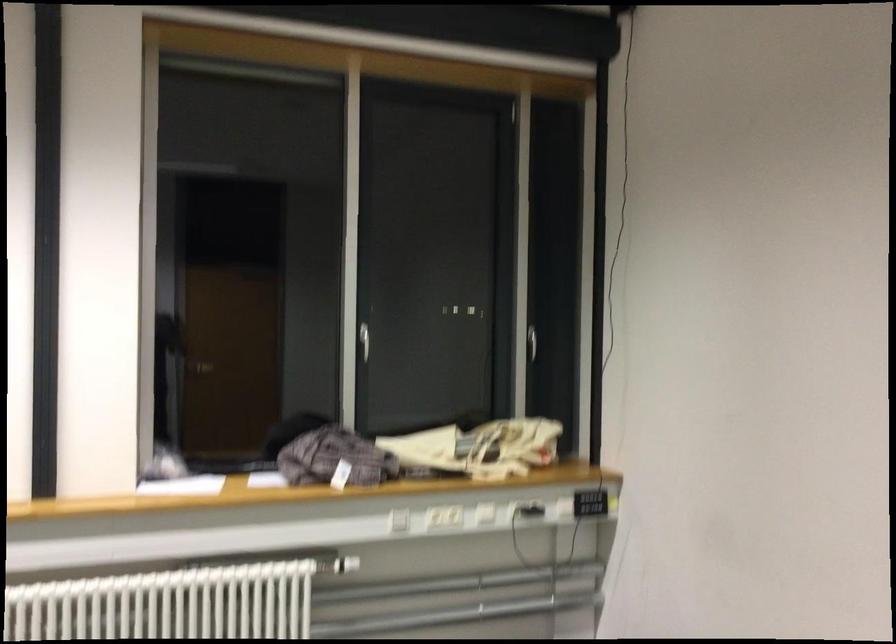
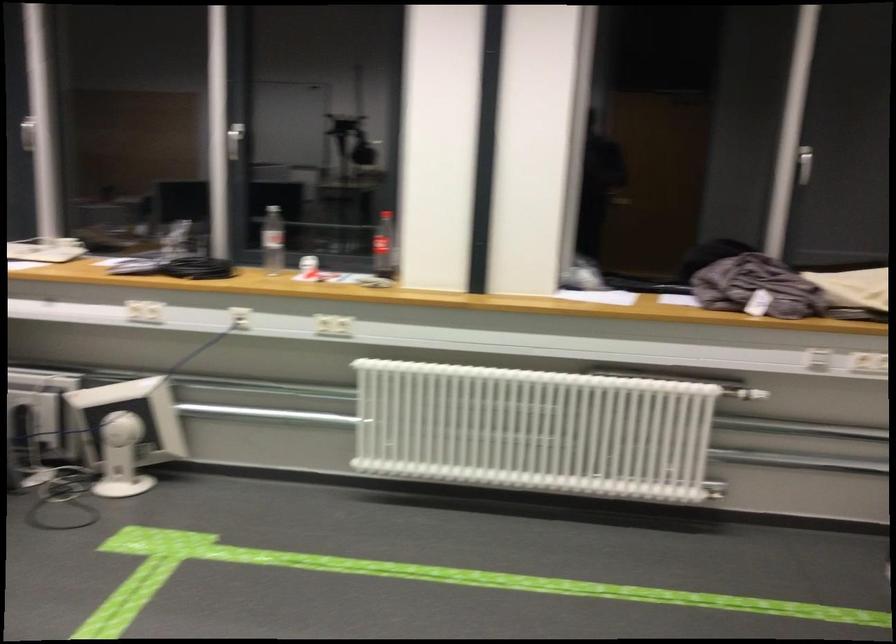
Where in the second image is the point corresponding to [364,351] from the first image?

(804, 164)